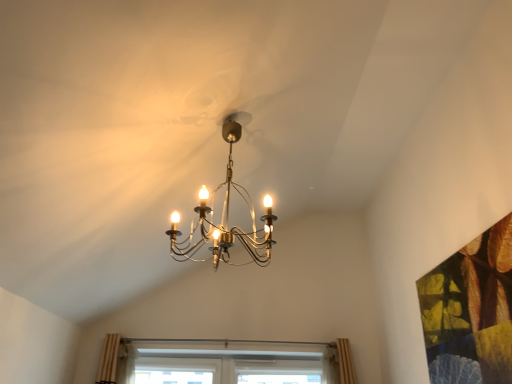
Image resolution: width=512 pixels, height=384 pixels. Describe the element at coordinates (225, 217) in the screenshot. I see `polished brass chandelier at center` at that location.

Identify the location of polished brass chandelier at center. Image resolution: width=512 pixels, height=384 pixels. (225, 217).

Find the location of a particular element. The width and height of the screenshot is (512, 384). polished brass chandelier at center is located at coordinates (225, 217).